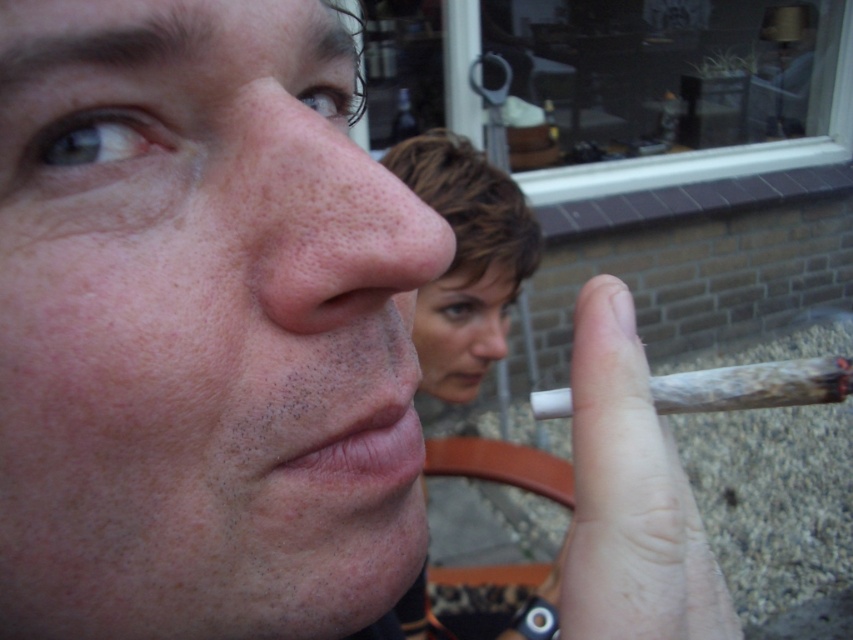
You are a photographer adjusting your camera to focus on two points in the image. The first point is at coordinates point (x=605, y=531) and the second is at point (x=505, y=337). Which point should you focus on first if you want to capture the closest object to the camera?

Point (x=605, y=531) is closer to the viewer than point (x=505, y=337), so you should focus on point (x=605, y=531) first to capture the closest object.